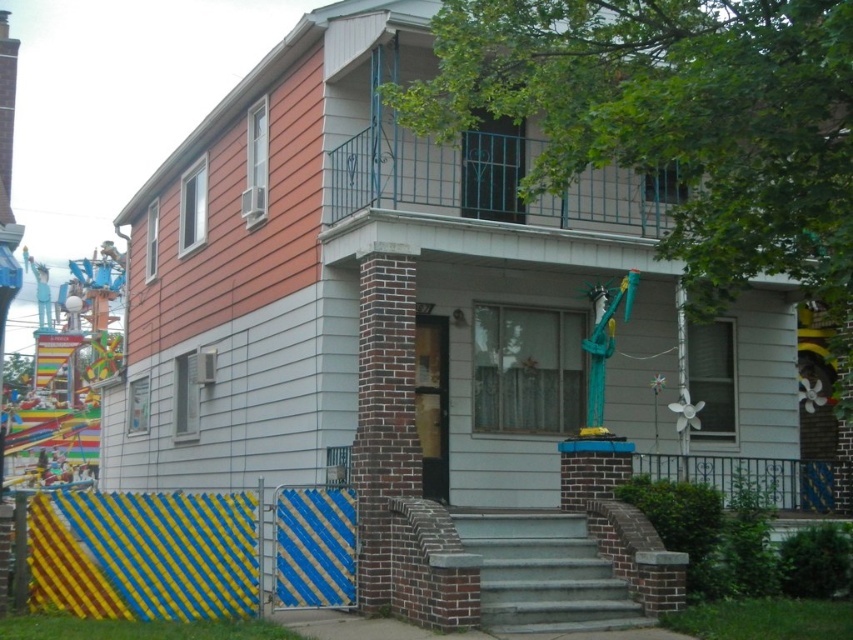
You are a painter who needs to choose between painting the yellow and blue striped gate at lower left or the gray concrete stairs at center. Which object requires a taller ladder to reach its top?

The yellow and blue striped gate at lower left is taller than the gray concrete stairs at center, so you need a taller ladder for the yellow and blue striped gate at lower left.

Consider the image. You are a delivery person trying to decide whether to park your van near the yellow and blue striped gate at lower left or the gray concrete stairs at center. Since you need to park as close as possible to the entrance without blocking any pathways, which location would allow your van to fit better based on their sizes?

The gray concrete stairs at center are larger than the yellow and blue striped gate at lower left, so parking near the gray concrete stairs at center would provide more space for the van to fit without blocking the pathway.

You are a delivery person with a heavy box that requires a cart to move. You need to deliver the box to the front door of the house. The cart can only be used on flat surfaces and cannot go up stairs. The yellow and blue striped gate at lower left is the entrance to the property. Can you use the cart from the gate to the gray concrete stairs at center to reach the front door?

The distance between the yellow and blue striped gate at lower left and the gray concrete stairs at center is 3.69 meters. Since the cart can be used on flat surfaces, you can push it from the gate to the stairs. However, the cart cannot go up the stairs, so you would need to carry the box manually from the stairs to the front door.